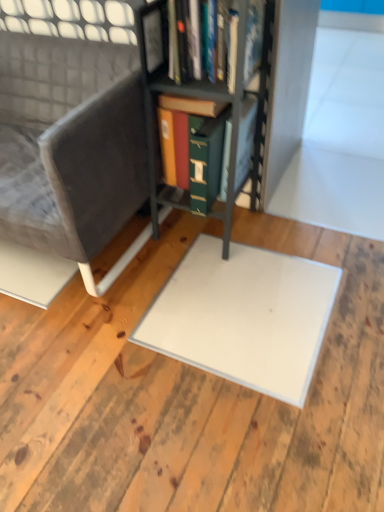
Question: Should I look upward or downward to see metallic gray bookcase at center?

Choices:
 (A) up
 (B) down

Answer: (A)

Question: Is metallic gray bookcase at center further to camera compared to velvet grey chair at left?

Choices:
 (A) yes
 (B) no

Answer: (B)

Question: Does metallic gray bookcase at center have a larger size compared to velvet grey chair at left?

Choices:
 (A) yes
 (B) no

Answer: (B)

Question: Are metallic gray bookcase at center and velvet grey chair at left beside each other?

Choices:
 (A) no
 (B) yes

Answer: (A)

Question: Is metallic gray bookcase at center turned away from velvet grey chair at left?

Choices:
 (A) no
 (B) yes

Answer: (A)

Question: Is metallic gray bookcase at center smaller than velvet grey chair at left?

Choices:
 (A) no
 (B) yes

Answer: (B)

Question: Considering the relative sizes of metallic gray bookcase at center and velvet grey chair at left in the image provided, is metallic gray bookcase at center shorter than velvet grey chair at left?

Choices:
 (A) no
 (B) yes

Answer: (A)

Question: Is velvet grey chair at left turned away from metallic gray bookcase at center?

Choices:
 (A) yes
 (B) no

Answer: (B)

Question: Is velvet grey chair at left positioned in front of metallic gray bookcase at center?

Choices:
 (A) yes
 (B) no

Answer: (B)

Question: Is velvet grey chair at left far away from metallic gray bookcase at center?

Choices:
 (A) yes
 (B) no

Answer: (B)

Question: From the image's perspective, is velvet grey chair at left on top of metallic gray bookcase at center?

Choices:
 (A) no
 (B) yes

Answer: (A)

Question: Can you see velvet grey chair at left touching metallic gray bookcase at center?

Choices:
 (A) yes
 (B) no

Answer: (B)

Question: Considering the relative positions of velvet grey chair at left and metallic gray bookcase at center in the image provided, is velvet grey chair at left behind metallic gray bookcase at center?

Choices:
 (A) yes
 (B) no

Answer: (A)

Question: Is white matte plywood at center placed right next to metallic gray bookcase at center?

Choices:
 (A) no
 (B) yes

Answer: (A)